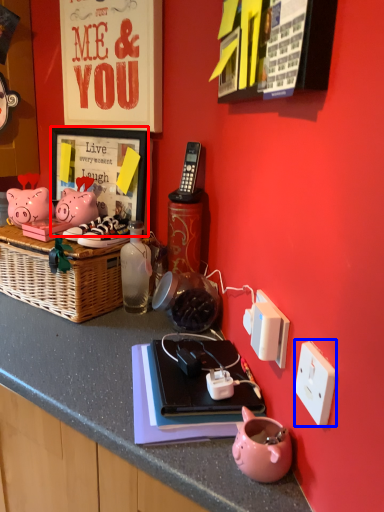
Question: Which point is closer to the camera, picture frame (highlighted by a red box) or power outlet (highlighted by a blue box)?

Choices:
 (A) picture frame
 (B) power outlet

Answer: (B)